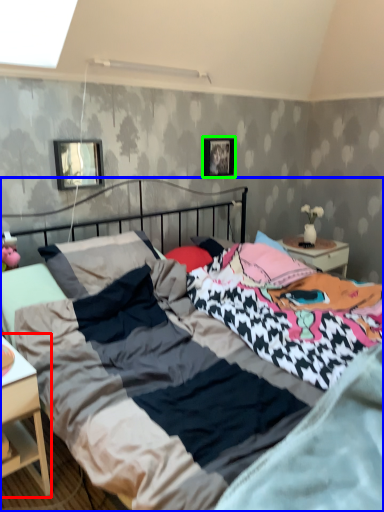
Question: Which object is the farthest from nightstand (highlighted by a red box)? Choose among these: bed (highlighted by a blue box) or picture frame (highlighted by a green box).

Choices:
 (A) bed
 (B) picture frame

Answer: (B)